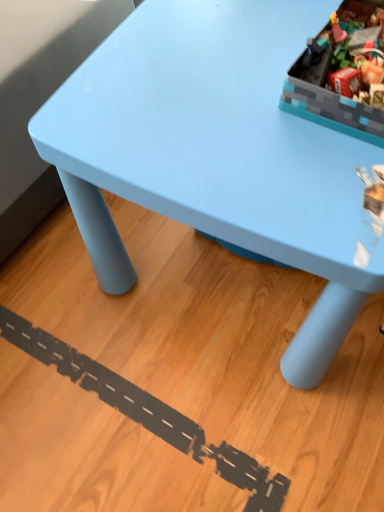
Question: Should I look upward or downward to see matte plastic storage box at upper right?

Choices:
 (A) up
 (B) down

Answer: (A)

Question: From the image's perspective, is matte plastic storage box at upper right below light blue plastic table at upper center?

Choices:
 (A) no
 (B) yes

Answer: (A)

Question: Is matte plastic storage box at upper right far away from light blue plastic table at upper center?

Choices:
 (A) yes
 (B) no

Answer: (B)

Question: Is light blue plastic table at upper center a part of matte plastic storage box at upper right?

Choices:
 (A) no
 (B) yes

Answer: (A)

Question: Is matte plastic storage box at upper right completely or partially outside of light blue plastic table at upper center?

Choices:
 (A) no
 (B) yes

Answer: (B)

Question: From the image's perspective, is matte plastic storage box at upper right over light blue plastic table at upper center?

Choices:
 (A) no
 (B) yes

Answer: (B)

Question: Can you see matte plastic storage box at upper right touching light blue plastic table at upper center?

Choices:
 (A) yes
 (B) no

Answer: (B)

Question: Does light blue plastic table at upper center have a greater width compared to matte plastic storage box at upper right?

Choices:
 (A) yes
 (B) no

Answer: (A)

Question: Does light blue plastic table at upper center touch matte plastic storage box at upper right?

Choices:
 (A) no
 (B) yes

Answer: (A)

Question: From the image's perspective, does light blue plastic table at upper center appear higher than matte plastic storage box at upper right?

Choices:
 (A) yes
 (B) no

Answer: (B)

Question: Does light blue plastic table at upper center contain matte plastic storage box at upper right?

Choices:
 (A) yes
 (B) no

Answer: (B)

Question: Does light blue plastic table at upper center have a larger size compared to matte plastic storage box at upper right?

Choices:
 (A) no
 (B) yes

Answer: (B)

Question: Is light blue plastic table at upper center further to camera compared to matte plastic storage box at upper right?

Choices:
 (A) no
 (B) yes

Answer: (A)

Question: Is light blue plastic table at upper center taller or shorter than matte plastic storage box at upper right?

Choices:
 (A) short
 (B) tall

Answer: (B)